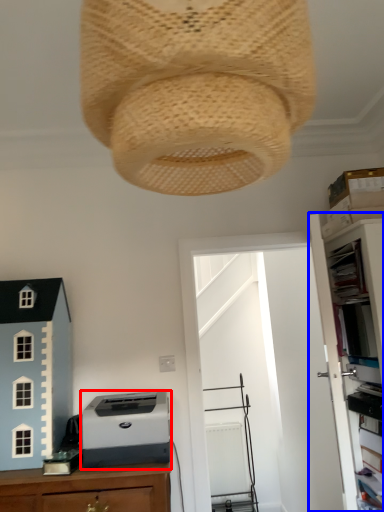
Question: Which object is closer to the camera taking this photo, printer (highlighted by a red box) or file cabinet (highlighted by a blue box)?

Choices:
 (A) printer
 (B) file cabinet

Answer: (B)